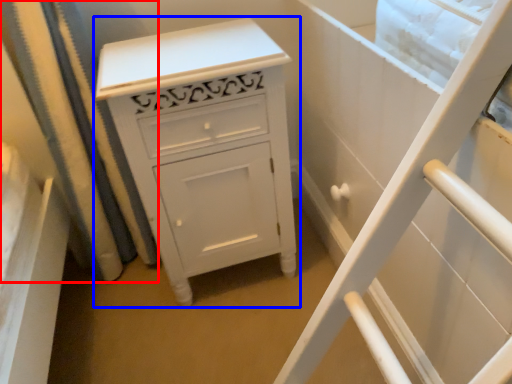
Question: Which object appears closest to the camera in this image, shower curtain (highlighted by a red box) or chest of drawers (highlighted by a blue box)?

Choices:
 (A) shower curtain
 (B) chest of drawers

Answer: (B)